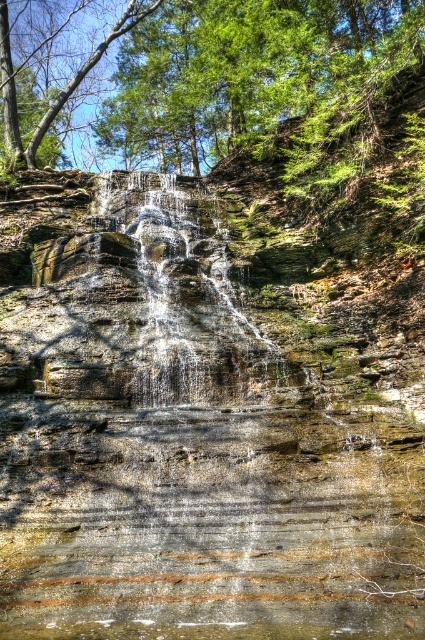
Question: Based on their relative distances, which object is nearer to the clear water at center?

Choices:
 (A) translucent water at center
 (B) green leafy tree at upper center

Answer: (A)

Question: Does clear water at center appear under translucent water at center?

Choices:
 (A) yes
 (B) no

Answer: (A)

Question: Estimate the real-world distances between objects in this image. Which object is farther from the clear water at center?

Choices:
 (A) green leafy tree at upper center
 (B) translucent water at center

Answer: (A)

Question: Is green leafy tree at upper center to the right of translucent water at center from the viewer's perspective?

Choices:
 (A) no
 (B) yes

Answer: (A)

Question: Which point is farther to the camera?

Choices:
 (A) translucent water at center
 (B) green leafy tree at upper center
 (C) clear water at center

Answer: (B)

Question: Does clear water at center have a greater width compared to translucent water at center?

Choices:
 (A) yes
 (B) no

Answer: (A)